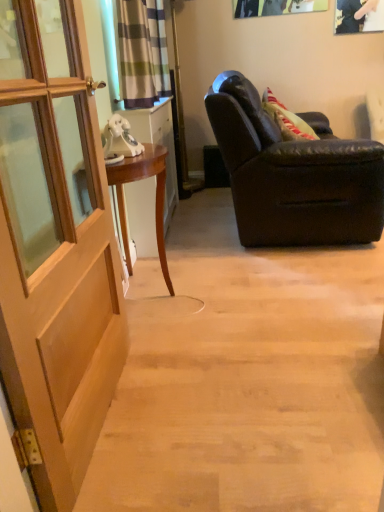
Locate an element on the screen. The image size is (384, 512). vacant space underneath light brown wood door at left (from a real-world perspective) is located at coordinates (105, 421).